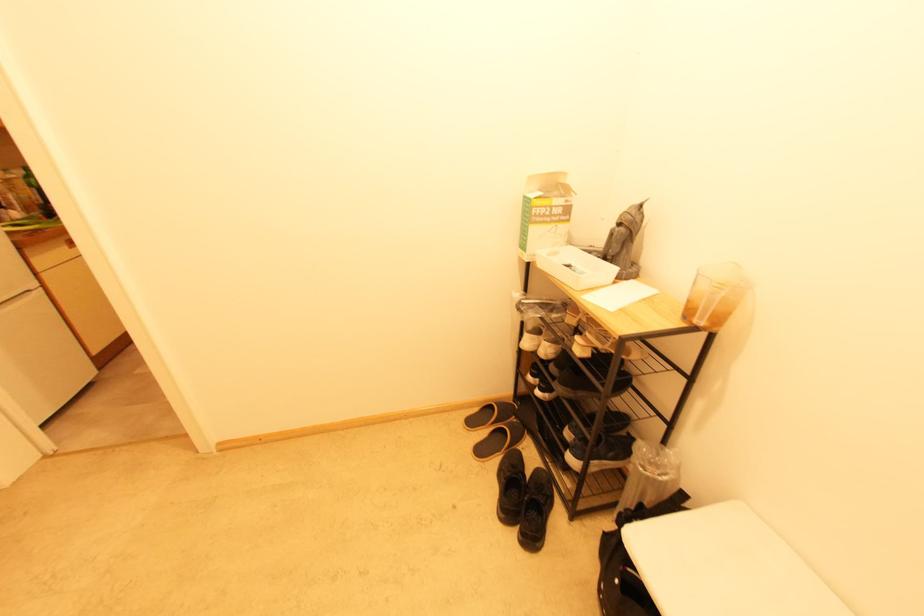
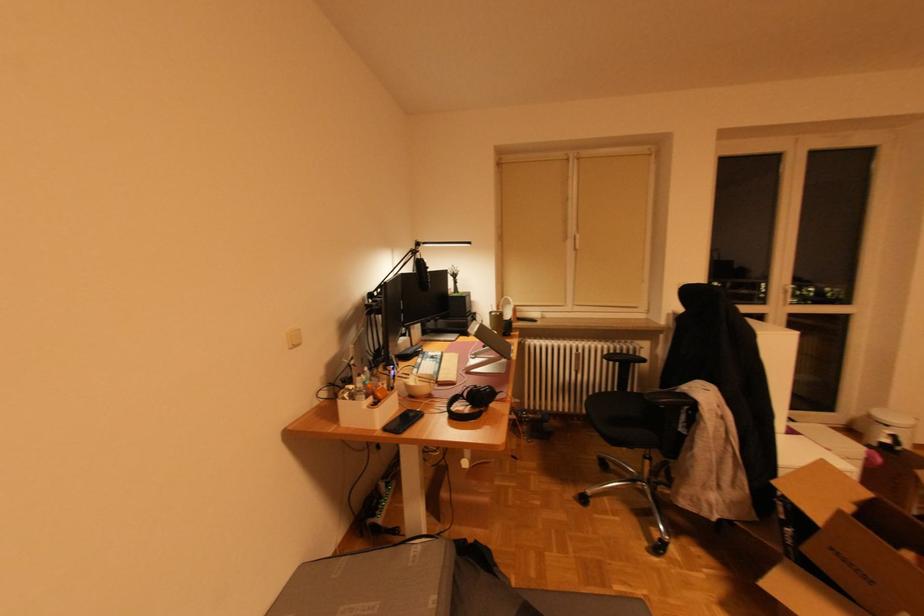
Question: The images are taken continuously from a first-person perspective. In which direction are you moving?

Choices:
 (A) Left
 (B) Right
 (C) Forward
 (D) Backward

Answer: (B)